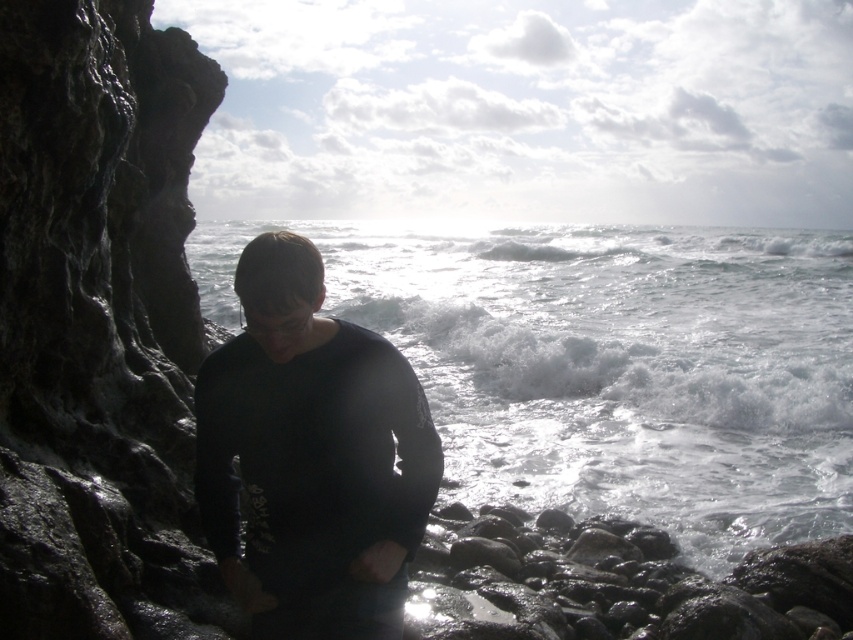
Question: In this image, where is white frothy water at center located relative to black matte shirt at center?

Choices:
 (A) below
 (B) above

Answer: (B)

Question: Is white frothy water at center thinner than dark gray rocky cliff at left?

Choices:
 (A) no
 (B) yes

Answer: (A)

Question: Which point is farther from the camera taking this photo?

Choices:
 (A) (842, 356)
 (B) (320, 576)
 (C) (80, 104)

Answer: (A)

Question: Which point is closer to the camera taking this photo?

Choices:
 (A) (347, 435)
 (B) (734, 285)
 (C) (83, 349)

Answer: (A)

Question: Is white frothy water at center thinner than black matte shirt at center?

Choices:
 (A) no
 (B) yes

Answer: (A)

Question: Which point is closer to the camera taking this photo?

Choices:
 (A) (80, 8)
 (B) (258, 566)

Answer: (B)